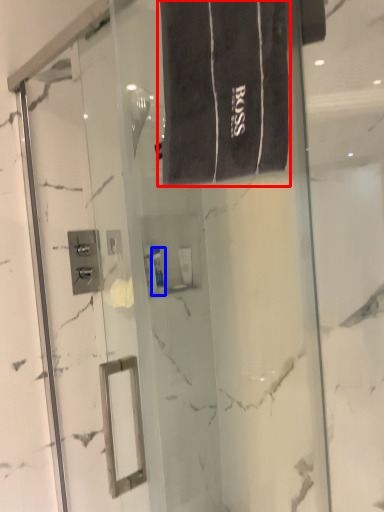
Question: Which object is closer to the camera taking this photo, bath towel (highlighted by a red box) or toiletry (highlighted by a blue box)?

Choices:
 (A) bath towel
 (B) toiletry

Answer: (A)